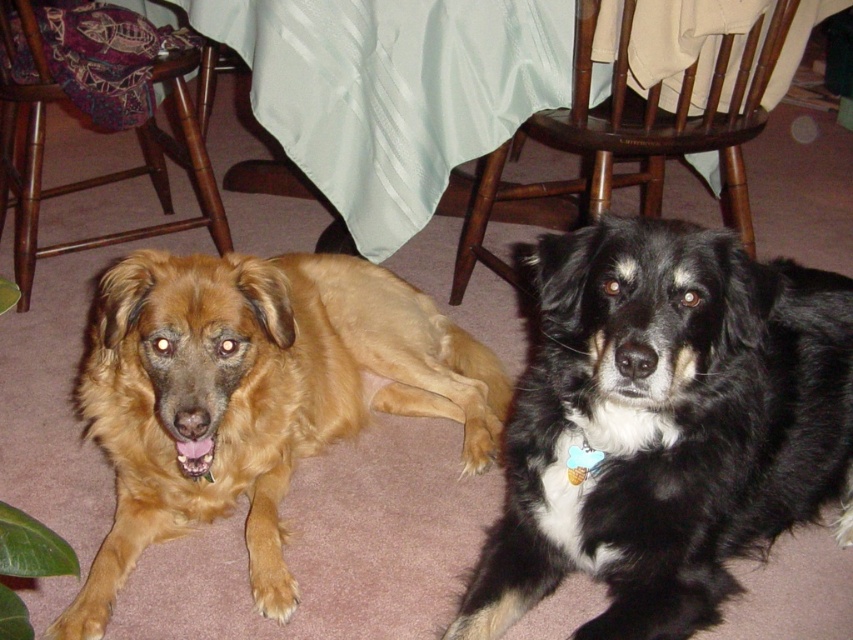
Based on the photo, you are a photographer setting up a shot of the two dogs in the image. You want to focus on the point closer to the camera. Which point should you choose between point (815, 490) and point (195, 152)?

Point (815, 490) is closer to the camera than point (195, 152), so you should choose point (815, 490) to focus on.